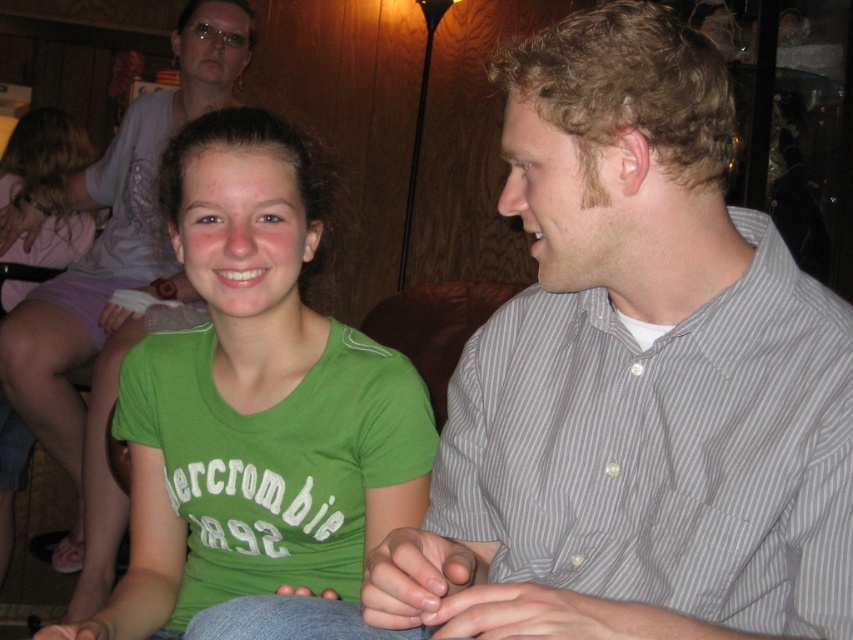
Is gray striped shirt at right to the right of green fabric shirt at center from the viewer's perspective?

Correct, you'll find gray striped shirt at right to the right of green fabric shirt at center.

Is point (595, 528) positioned in front of point (183, 131)?

Yes, point (595, 528) is closer to viewer.

Where is `gray striped shirt at right`? This screenshot has height=640, width=853. gray striped shirt at right is located at coordinates (664, 449).

Which is more to the right, gray striped shirt at right or green t-shirt at center?

gray striped shirt at right is more to the right.

In the scene shown: Is gray striped shirt at right below green t-shirt at center?

Yes.

What do you see at coordinates (664, 449) in the screenshot? Image resolution: width=853 pixels, height=640 pixels. I see `gray striped shirt at right` at bounding box center [664, 449].

Find the location of a particular element. gray striped shirt at right is located at coordinates pyautogui.click(x=664, y=449).

Is green fabric shirt at center shorter than green t-shirt at center?

Indeed, green fabric shirt at center has a lesser height compared to green t-shirt at center.

Does green fabric shirt at center have a larger size compared to green t-shirt at center?

Actually, green fabric shirt at center might be smaller than green t-shirt at center.

Is point (177, 433) farther from viewer compared to point (113, 336)?

No, (177, 433) is in front of (113, 336).

You are a GUI agent. You are given a task and a screenshot of the screen. Output one action in this format:
    pyautogui.click(x=<x>, y=<y>)
    Task: Click on the green fabric shirt at center
    Image resolution: width=853 pixels, height=640 pixels.
    Given the screenshot: What is the action you would take?
    pyautogui.click(x=254, y=401)